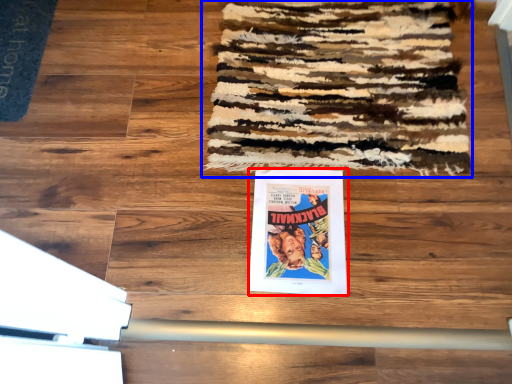
Question: Which point is further to the camera, poster (highlighted by a red box) or mat (highlighted by a blue box)?

Choices:
 (A) poster
 (B) mat

Answer: (B)